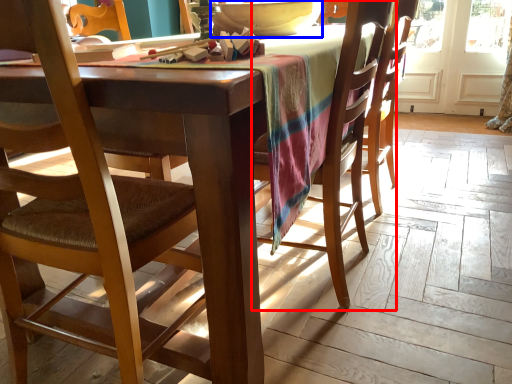
Question: Which object appears closest to the camera in this image, chair (highlighted by a red box) or bowl (highlighted by a blue box)?

Choices:
 (A) chair
 (B) bowl

Answer: (A)